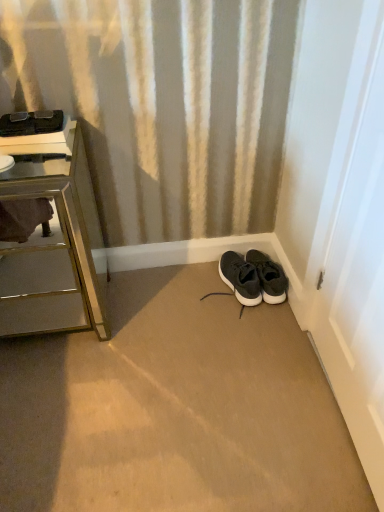
Identify the location of vacant space in front of metallic mirrored chest of drawers at left. (62, 407).